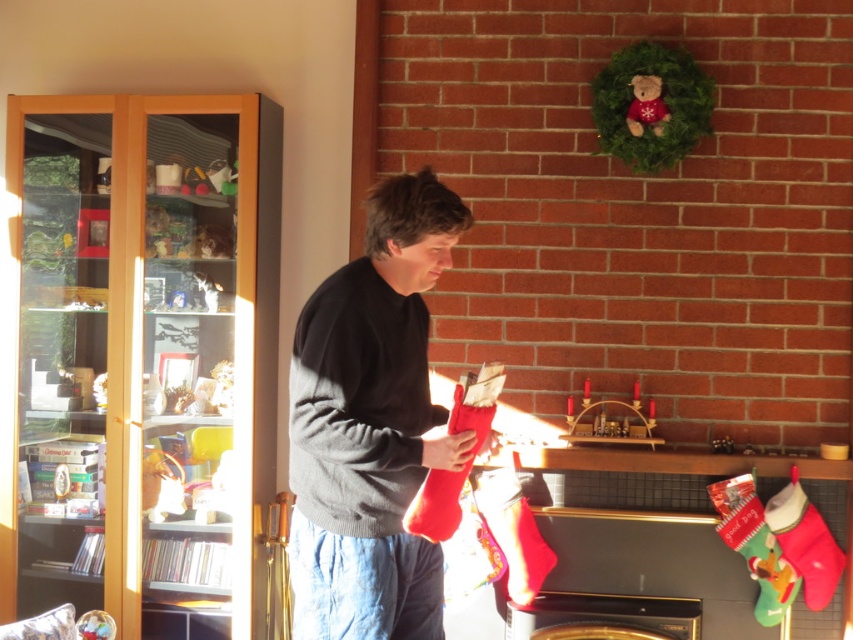
Question: Which of the following is the closest to the observer?

Choices:
 (A) (264, 349)
 (B) (396, 580)

Answer: (B)

Question: Is wooden bookshelf at left above dark gray sweater at center?

Choices:
 (A) yes
 (B) no

Answer: (A)

Question: Is wooden bookshelf at left wider than dark gray sweater at center?

Choices:
 (A) no
 (B) yes

Answer: (B)

Question: Does wooden bookshelf at left appear on the left side of dark gray sweater at center?

Choices:
 (A) no
 (B) yes

Answer: (B)

Question: Which point is closer to the camera?

Choices:
 (A) dark gray sweater at center
 (B) wooden bookshelf at left

Answer: (A)

Question: Which point appears closest to the camera in this image?

Choices:
 (A) (303, 362)
 (B) (248, 548)

Answer: (A)